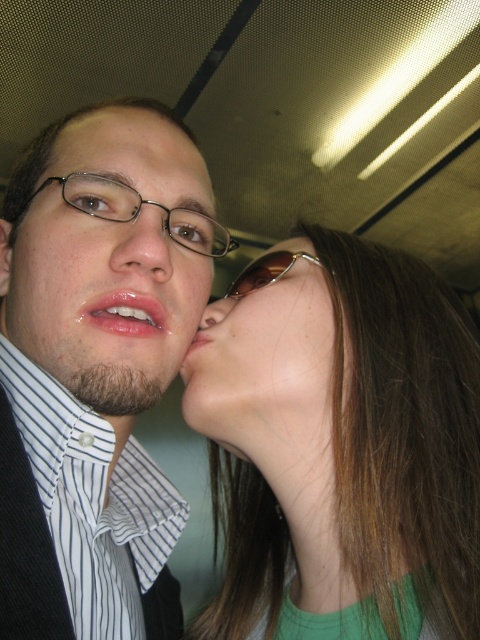
You are standing in a public transportation vehicle and want to place a small gift box that is 18 inches long on the floor between you and the point at coordinates point (x=93, y=212). Can the gift box fit in that space?

The distance between you and the point (x=93, y=212) is 19.18 inches, which is longer than the gift box length of 18 inches. Therefore, the gift box can fit in that space.

You are a photographer who just took a photo of two people. You have two sunglasses in the frame. The sunglasses at center and the brown shiny sunglasses at upper center. Which one is bigger?

The sunglasses at center is larger in size than the brown shiny sunglasses at upper center, so the sunglasses at center is bigger.

Based on the photo, you are a photographer standing in front of a blurred background with a ceiling grid and fluorescent lights. You see the matte metal glasses at upper left and the matte pink lips at center. Which object is nearer to you?

The matte metal glasses at upper left is closer to the viewer than the matte pink lips at center.